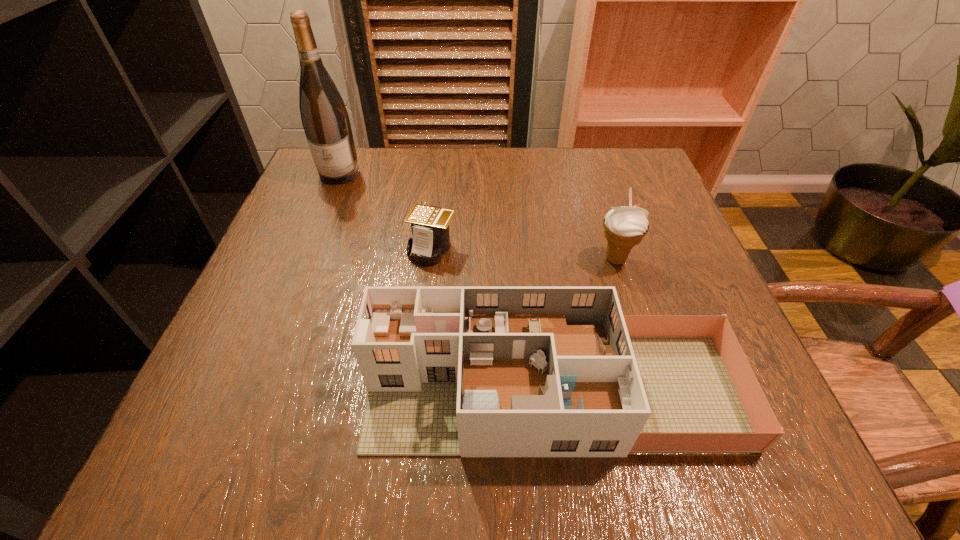
Locate an element on the screen. This screenshot has width=960, height=540. the leftmost object is located at coordinates (325, 119).

Locate an element on the screen. This screenshot has width=960, height=540. the farthest object is located at coordinates (325, 119).

Find the location of a particular element. This screenshot has height=540, width=960. icecream is located at coordinates (624, 227).

At what (x,y) coordinates should I click in order to perform the action: click on the nearest object. Please return your answer as a coordinate pair (x, y). This screenshot has height=540, width=960. Looking at the image, I should click on (451, 371).

The width and height of the screenshot is (960, 540). I want to click on the third tallest object, so click(451, 371).

Where is `calculator`? The image size is (960, 540). calculator is located at coordinates (430, 240).

Locate an element on the screen. The image size is (960, 540). vacant space situated 0.350m on the label of the wine bottle is located at coordinates (292, 294).

Where is `free space located on the left of the icecream`? free space located on the left of the icecream is located at coordinates (536, 259).

Locate an element on the screen. free space located at the entrance of the dollhouse is located at coordinates (329, 391).

Identify the location of free location located 0.250m at the entrance of the dollhouse. (206, 391).